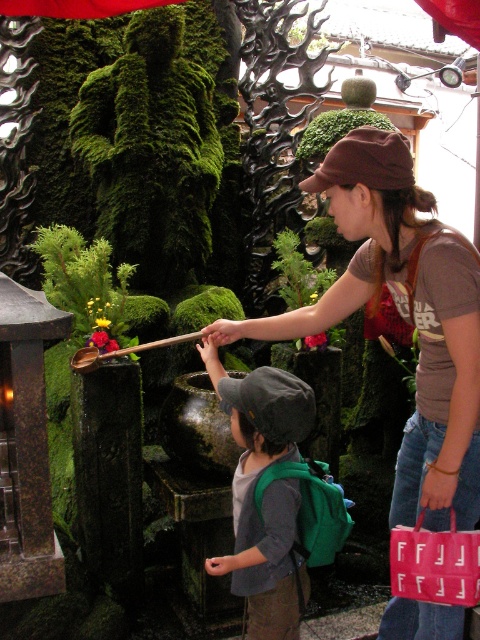
Between brown fabric shirt at center and gray fabric cap at center, which one appears on the right side from the viewer's perspective?

Positioned to the right is brown fabric shirt at center.

Between point (364, 250) and point (247, 449), which one is positioned in front?

Point (364, 250) is more forward.

The image size is (480, 640). In order to click on brown fabric shirt at center in this screenshot , I will do `click(403, 316)`.

Is point (296, 332) closer to viewer compared to point (336, 180)?

No.

Between brown fabric shirt at center and brown fabric baseball cap at center, which one is positioned lower?

brown fabric shirt at center is below.

What do you see at coordinates (403, 316) in the screenshot? The image size is (480, 640). I see `brown fabric shirt at center` at bounding box center [403, 316].

The height and width of the screenshot is (640, 480). I want to click on brown fabric shirt at center, so click(403, 316).

Is point (303, 566) closer to viewer compared to point (376, 134)?

No, it is behind (376, 134).

Based on the photo, can you confirm if gray fabric cap at center is positioned to the left of brown fabric baseball cap at center?

Indeed, gray fabric cap at center is positioned on the left side of brown fabric baseball cap at center.

Which is in front, point (242, 404) or point (335, 182)?

Point (335, 182) is in front.

Locate an element on the screen. gray fabric cap at center is located at coordinates (264, 493).